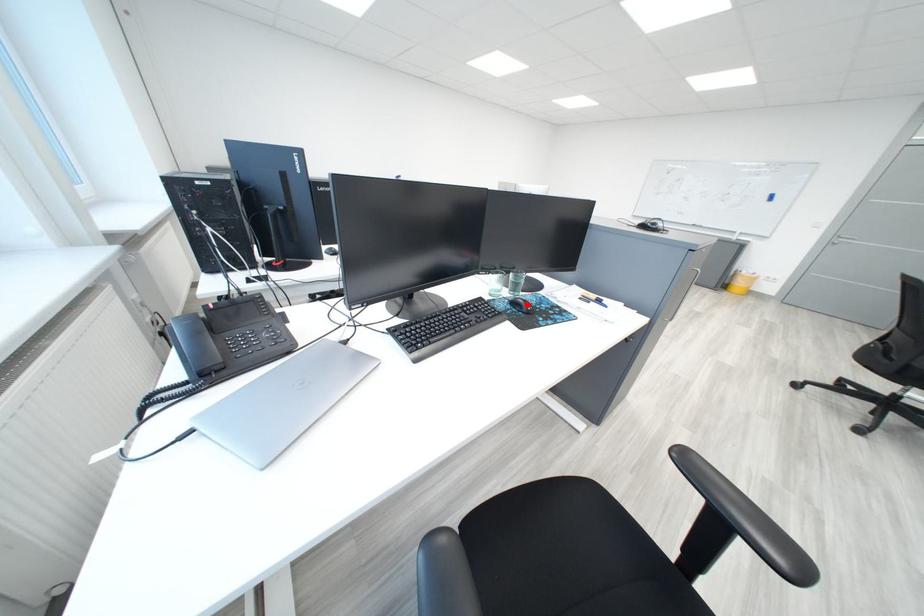
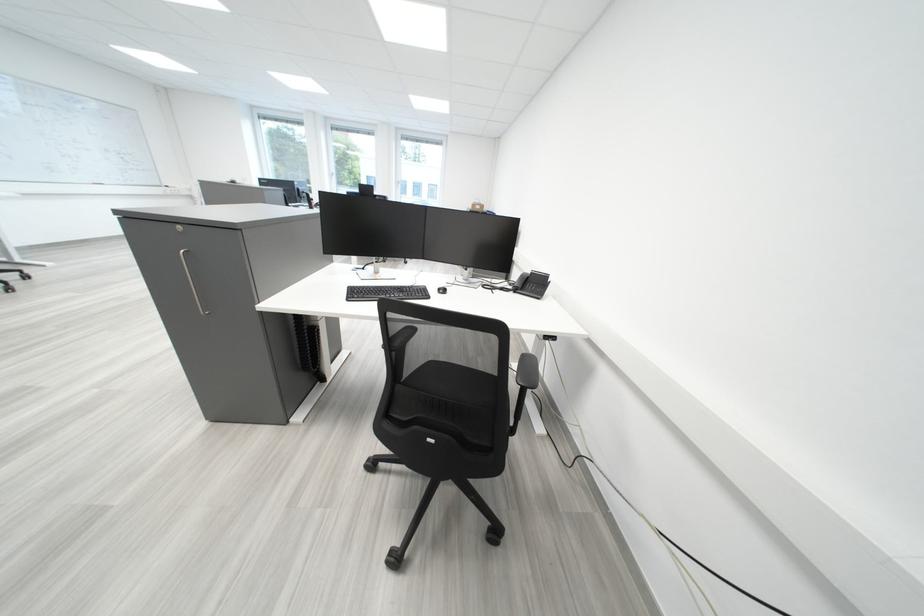
Question: I am providing you with two images of the same scene from different viewpoints. A red point is marked on the first image. At the location where the point appears in image 1, is it still visible in image 2?

Choices:
 (A) Yes
 (B) No

Answer: (B)